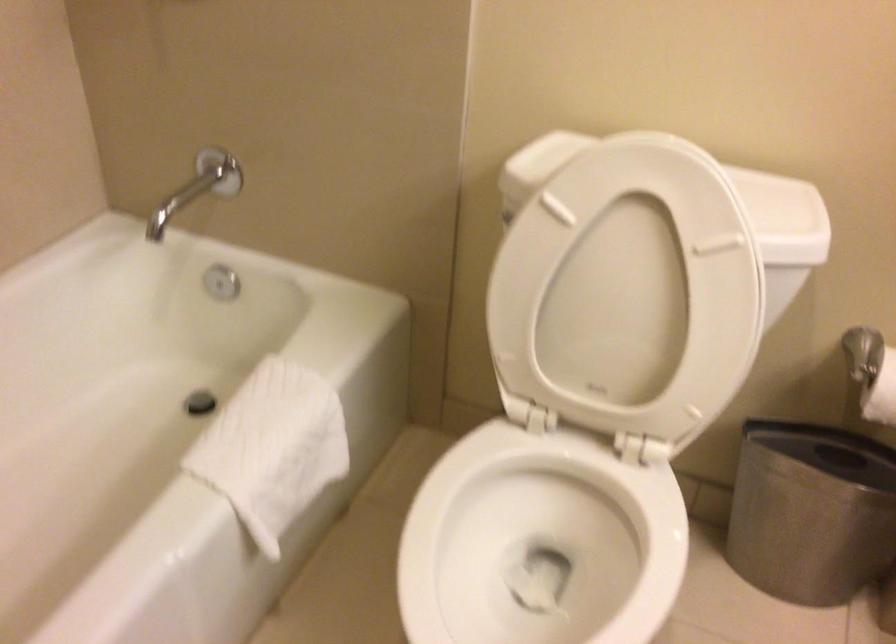
Where is `white toilet seat`? This screenshot has height=644, width=896. white toilet seat is located at coordinates (539, 542).